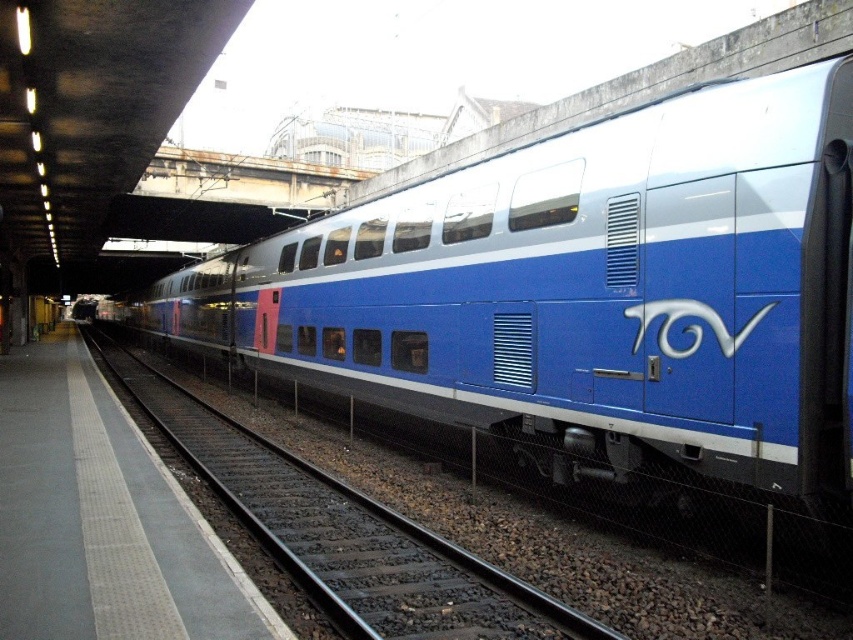
Question: Does blue metallic train at center have a lesser width compared to metal track at center?

Choices:
 (A) no
 (B) yes

Answer: (B)

Question: Which object appears closest to the camera in this image?

Choices:
 (A) metal track at center
 (B) blue metallic train at center

Answer: (A)

Question: Considering the relative positions of blue metallic train at center and metal track at center in the image provided, where is blue metallic train at center located with respect to metal track at center?

Choices:
 (A) left
 (B) right

Answer: (B)

Question: Which point is farther to the camera?

Choices:
 (A) metal track at center
 (B) blue metallic train at center

Answer: (B)

Question: Can you confirm if blue metallic train at center is smaller than metal track at center?

Choices:
 (A) yes
 (B) no

Answer: (B)